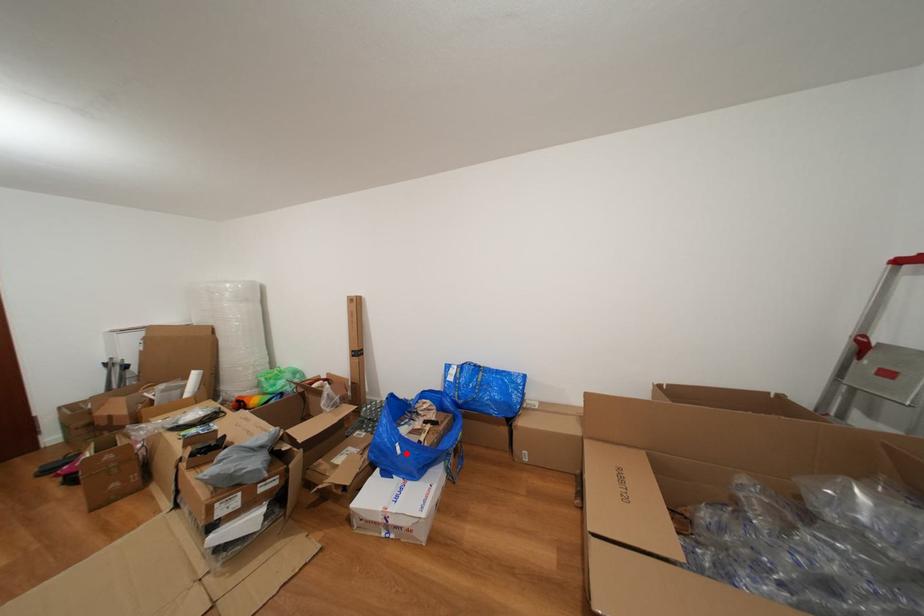
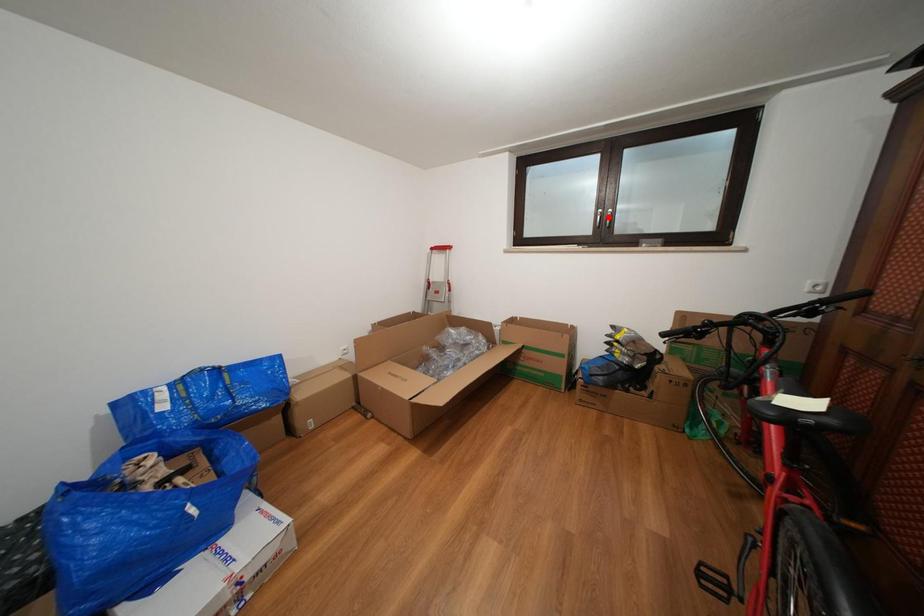
I am providing you with two images of the same scene from different viewpoints. A red point is marked on the first image and another point is marked on the second image. Does the point marked in image1 correspond to the same location as the one in image2?

No